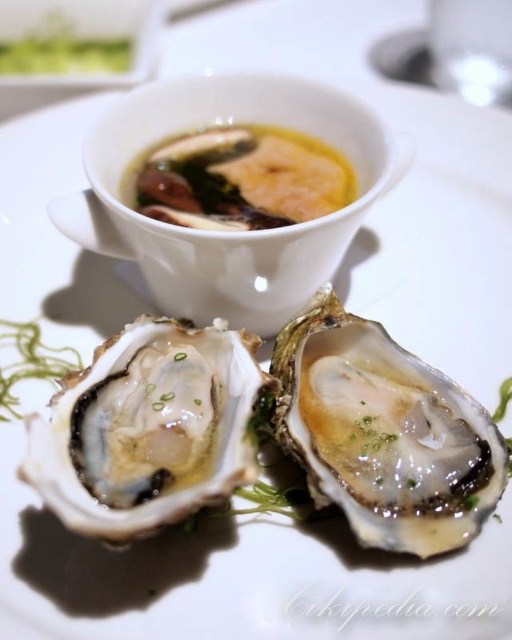
Question: Which point appears closest to the camera in this image?

Choices:
 (A) (393, 397)
 (B) (151, 333)

Answer: (A)

Question: Which object is farther from the camera taking this photo?

Choices:
 (A) yellow creamy broth at upper center
 (B) shiny white oyster at center

Answer: (A)

Question: Is shiny white oyster at center bigger than yellow creamy broth at upper center?

Choices:
 (A) no
 (B) yes

Answer: (B)

Question: Which point is closer to the camera?

Choices:
 (A) (134, 512)
 (B) (334, 404)

Answer: (A)

Question: Can you confirm if shiny white oyster at center is positioned to the right of yellow creamy broth at upper center?

Choices:
 (A) no
 (B) yes

Answer: (A)

Question: Is glistening white oyster at center further to the viewer compared to shiny white oyster at center?

Choices:
 (A) yes
 (B) no

Answer: (A)